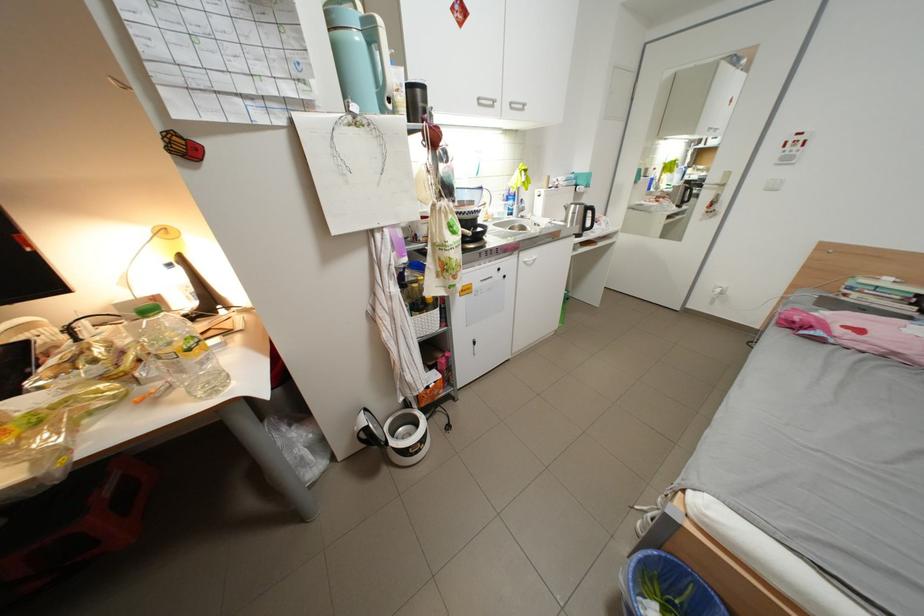
Find where to lift the faucet handle. Please return your answer as a coordinate pair (x, y).

(519, 207)